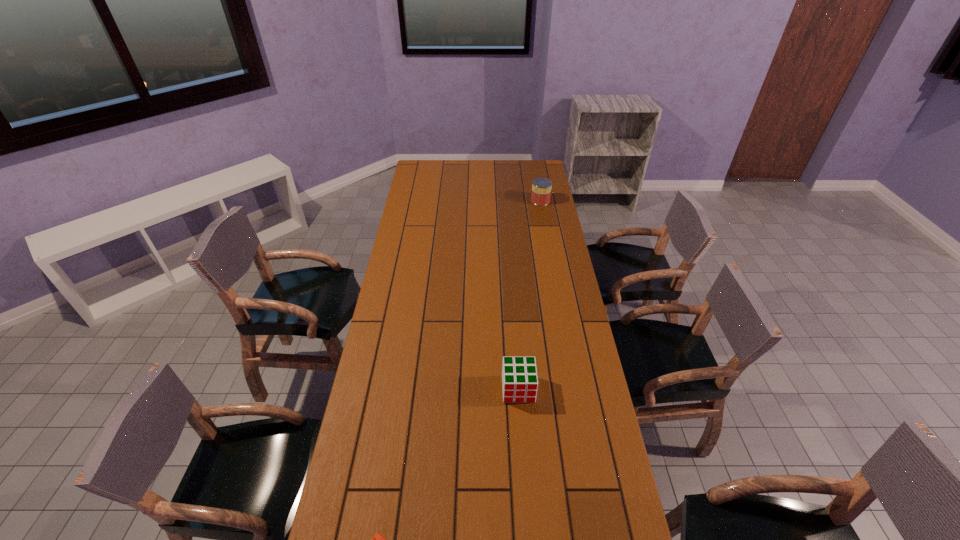
Identify the location of free area in between the second farthest object and the rightmost object. The width and height of the screenshot is (960, 540). (529, 295).

Find the location of `free spot between the taller cube and the rightmost object`. free spot between the taller cube and the rightmost object is located at coordinates (529, 295).

Locate an element on the screen. This screenshot has width=960, height=540. blank region between the second farthest object and the farthest object is located at coordinates (529, 295).

Find the location of a particular element. free space that is in between the second object from right to left and the rightmost object is located at coordinates (529, 295).

Where is `empty space that is in between the second farthest object and the rightmost object`? This screenshot has width=960, height=540. empty space that is in between the second farthest object and the rightmost object is located at coordinates (x=529, y=295).

Identify the location of vacant space in between the farthest object and the taller cube. (529, 295).

Choose which object is the second nearest neighbor to the shorter cube. Please provide its 2D coordinates. Your answer should be formatted as a tuple, i.e. [(x, y)], where the tuple contains the x and y coordinates of a point satisfying the conditions above.

[(541, 187)]

The image size is (960, 540). I want to click on the second closest object to the can, so click(x=378, y=539).